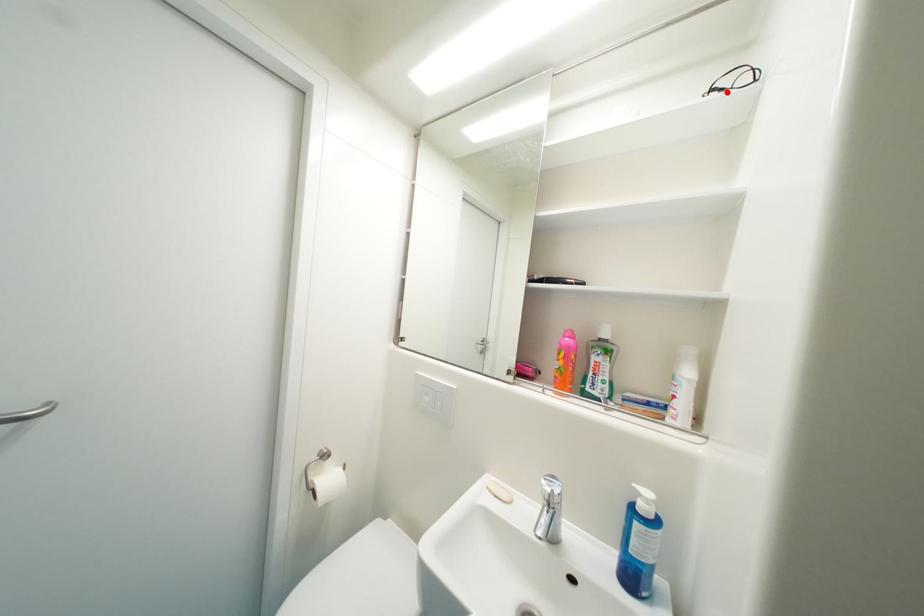
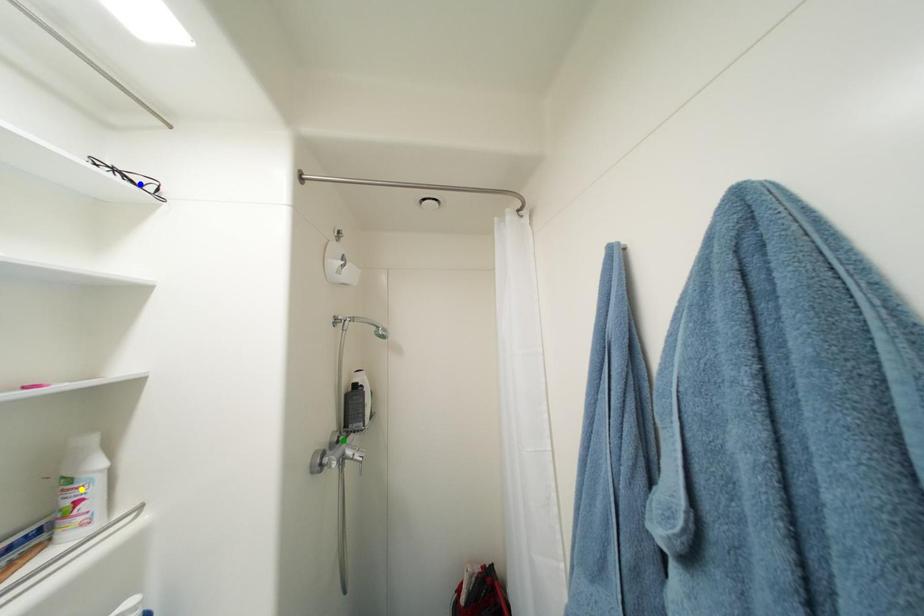
Question: I am providing you with two images of the same scene from different viewpoints. A red point is marked on the first image. You are given multiple points on the second image. Which spot in image 2 lines up with the point in image 1?

Choices:
 (A) blue point
 (B) yellow point
 (C) green point

Answer: (A)